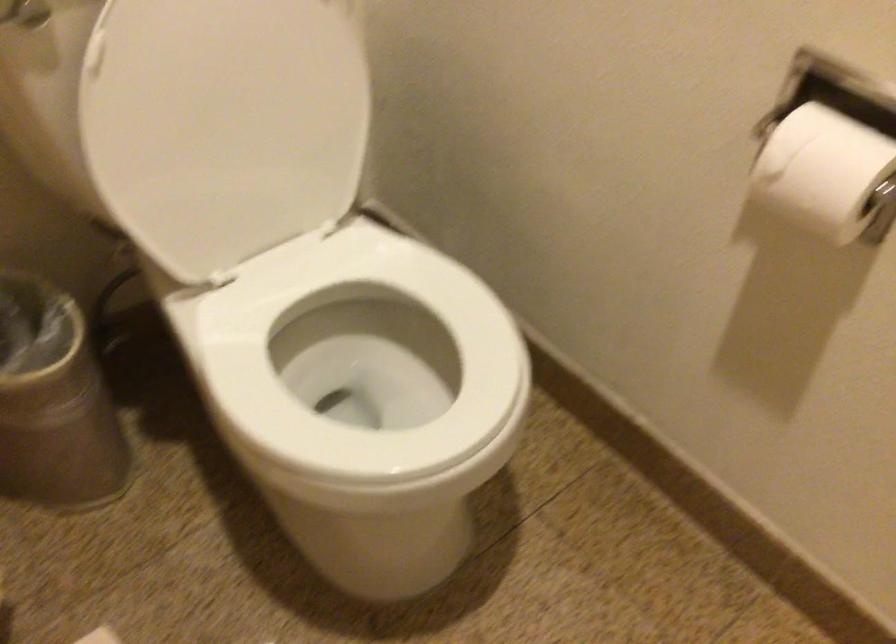
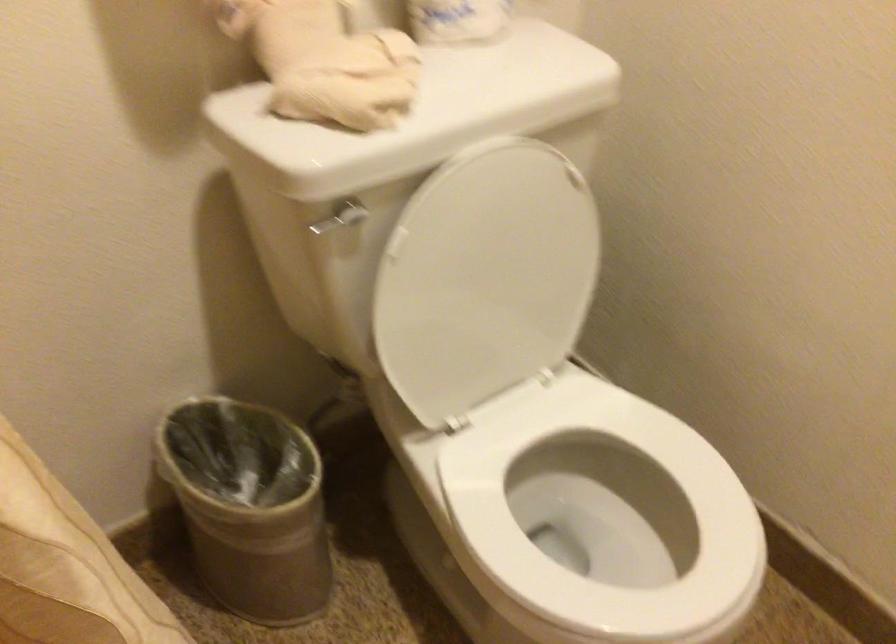
Question: Based on the continuous images, in which direction is the camera rotating? Reply with the corresponding letter.

Choices:
 (A) Left
 (B) Right
 (C) Up
 (D) Down

Answer: (C)